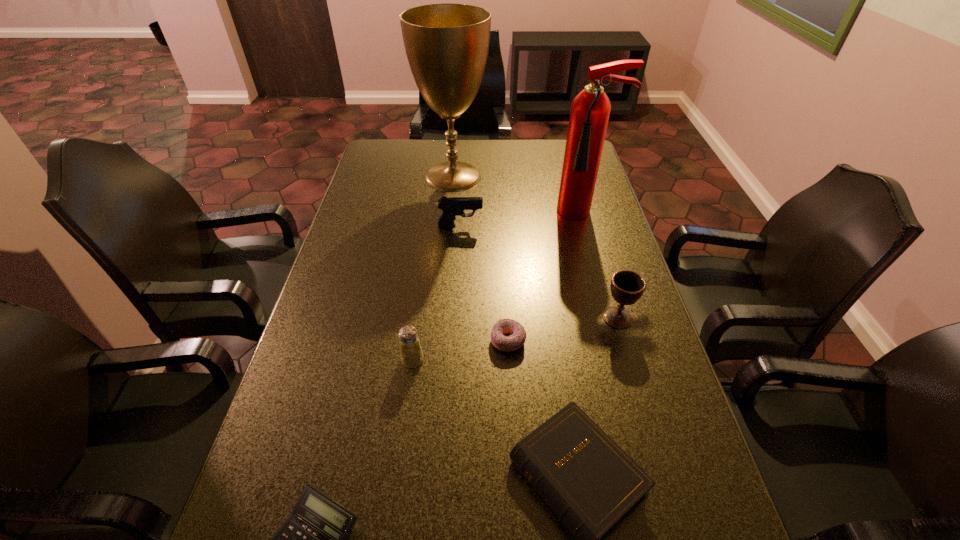
Where is `vacant space located on the front of the saltshaker`? Image resolution: width=960 pixels, height=540 pixels. vacant space located on the front of the saltshaker is located at coordinates (390, 530).

Locate an element on the screen. Image resolution: width=960 pixels, height=540 pixels. free region located 0.370m on the back of the seventh tallest object is located at coordinates (502, 235).

This screenshot has width=960, height=540. What are the coordinates of `object located at the far edge` in the screenshot? It's located at (447, 44).

The image size is (960, 540). I want to click on fire extinguisher that is at the right edge, so click(x=590, y=109).

Where is `chalice at the right edge`? The width and height of the screenshot is (960, 540). chalice at the right edge is located at coordinates (627, 287).

Where is `free space at the far edge`? free space at the far edge is located at coordinates (513, 142).

You are a GUI agent. You are given a task and a screenshot of the screen. Output one action in this format:
    pyautogui.click(x=<x>, y=<y>)
    Task: Click on the free space at the left edge
    The width and height of the screenshot is (960, 540).
    Given the screenshot: What is the action you would take?
    pyautogui.click(x=355, y=253)

Image resolution: width=960 pixels, height=540 pixels. I want to click on free space at the right edge, so click(x=614, y=227).

This screenshot has height=540, width=960. In the image, there is a desktop. What are the coordinates of `vacant space at the far left corner` in the screenshot? It's located at (378, 167).

This screenshot has width=960, height=540. Identify the location of empty space between the trophy cup and the chalice. (536, 247).